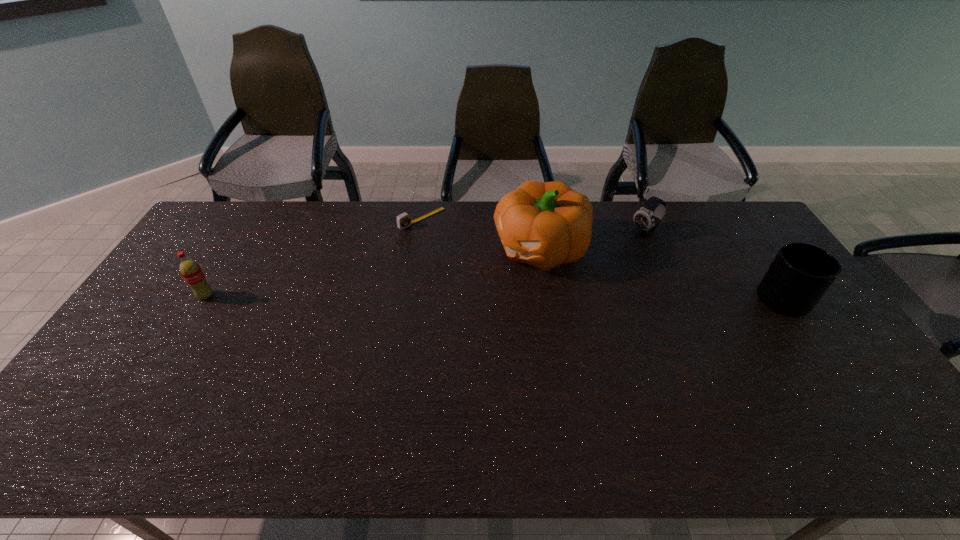
Find the location of a particular element. free space between the mug and the soda is located at coordinates (498, 298).

Locate an element on the screen. The height and width of the screenshot is (540, 960). empty location between the leftmost object and the pumpkin is located at coordinates (373, 272).

The height and width of the screenshot is (540, 960). Identify the location of free space between the tallest object and the soda. (373, 272).

This screenshot has width=960, height=540. Identify the location of vacant area that lies between the second object from left to right and the leftmost object. (314, 257).

At what (x,y) coordinates should I click in order to perform the action: click on blank region between the rightmost object and the leftmost object. Please return your answer as a coordinate pair (x, y). This screenshot has width=960, height=540. Looking at the image, I should click on (498, 298).

At what (x,y) coordinates should I click in order to perform the action: click on blank region between the tallest object and the tape measure. Please return your answer as a coordinate pair (x, y). Image resolution: width=960 pixels, height=540 pixels. Looking at the image, I should click on (482, 234).

At what (x,y) coordinates should I click in order to perform the action: click on free point between the tallest object and the shortest object. Please return your answer as a coordinate pair (x, y). Looking at the image, I should click on (482, 234).

This screenshot has height=540, width=960. Identify the location of free space between the pumpkin and the second shortest object. (593, 240).

Identify the location of object that is the fourth closest to the leftmost object. Image resolution: width=960 pixels, height=540 pixels. (800, 274).

Locate which object ranks third in proximity to the rightmost object. Please provide its 2D coordinates. Your answer should be formatted as a tuple, i.e. [(x, y)], where the tuple contains the x and y coordinates of a point satisfying the conditions above.

[(403, 220)]